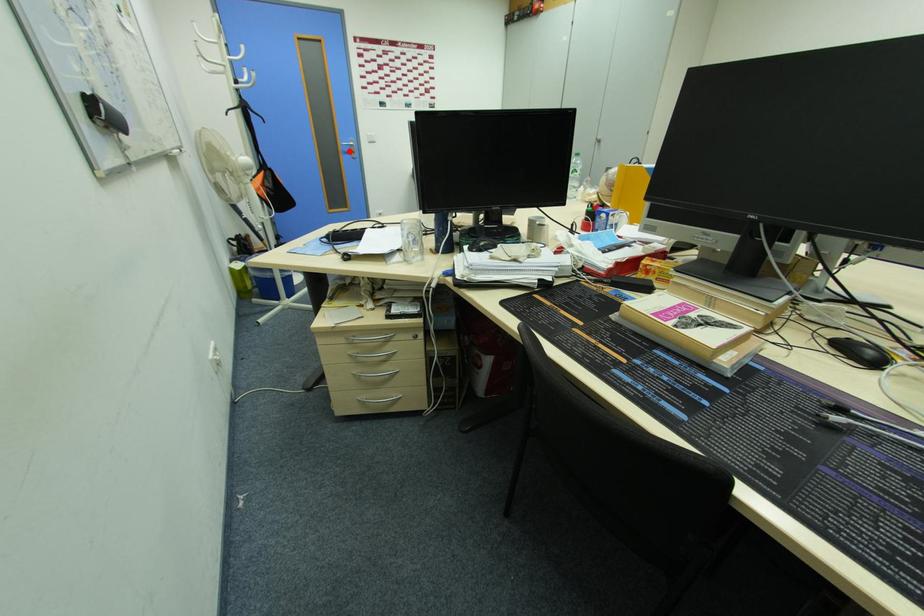
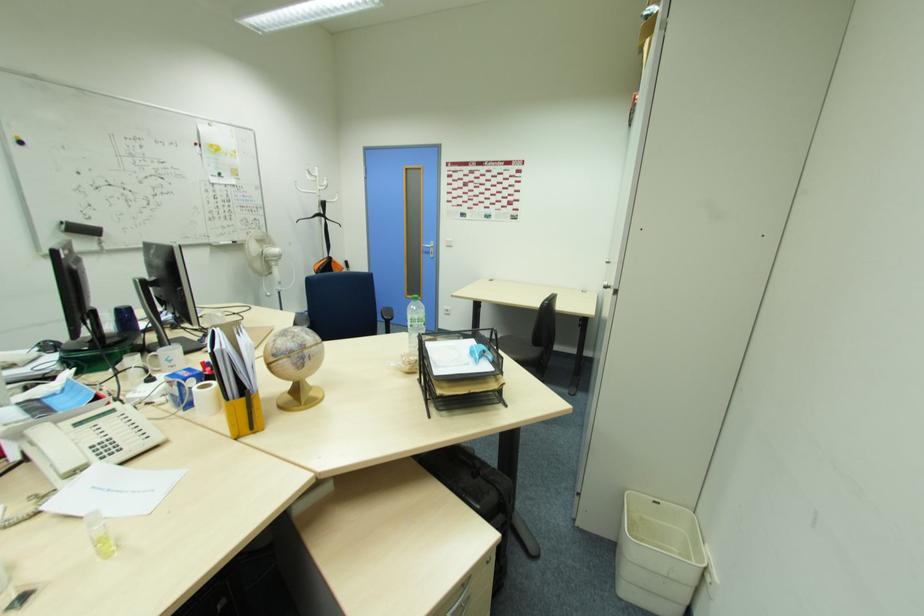
The point at the highlighted location is marked in the first image. Where is the corresponding point in the second image?

(430, 252)